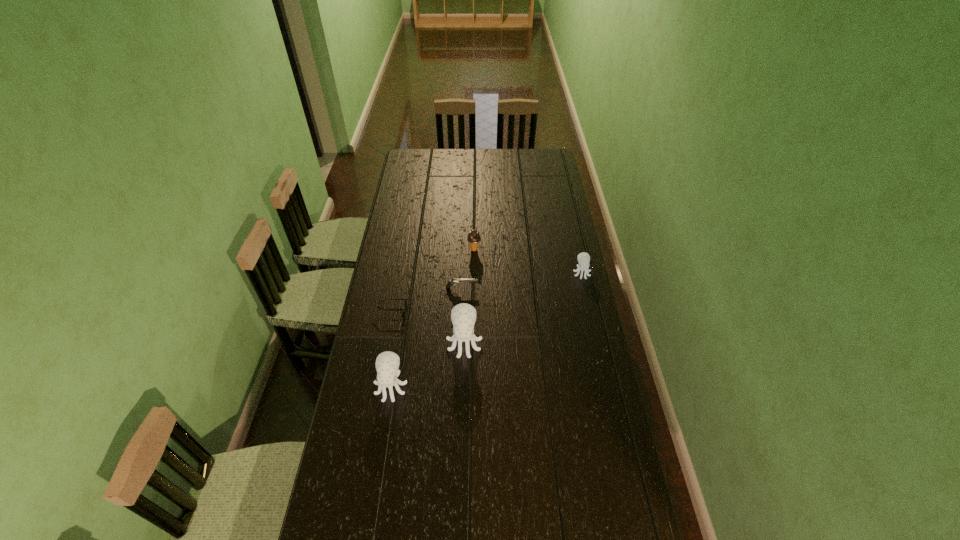
Find the location of a particular element. The width and height of the screenshot is (960, 540). the third nearest object is located at coordinates (403, 314).

The height and width of the screenshot is (540, 960). In order to click on sunglasses in this screenshot , I will do `click(403, 314)`.

Where is `vacant space located on the front-facing side of the nearest object`? vacant space located on the front-facing side of the nearest object is located at coordinates click(x=374, y=491).

Locate an element on the screen. vacant space located 0.330m on the front-facing side of the second nearest octopus is located at coordinates (462, 446).

The width and height of the screenshot is (960, 540). Identify the location of vacant space located on the front-facing side of the rightmost octopus. tap(592, 319).

Where is `free space located 0.250m on the front of the fourth shortest object`? free space located 0.250m on the front of the fourth shortest object is located at coordinates (473, 293).

Identify the location of blank area located on the front-facing side of the fifth tallest object. The height and width of the screenshot is (540, 960). (492, 288).

Image resolution: width=960 pixels, height=540 pixels. What are the coordinates of `free space located on the front-facing side of the third nearest object` in the screenshot? It's located at (428, 313).

Where is `octopus located in the left edge section of the desktop`? The width and height of the screenshot is (960, 540). octopus located in the left edge section of the desktop is located at coordinates (387, 363).

This screenshot has width=960, height=540. What are the coordinates of `sunglasses present at the left edge` in the screenshot? It's located at pyautogui.click(x=403, y=314).